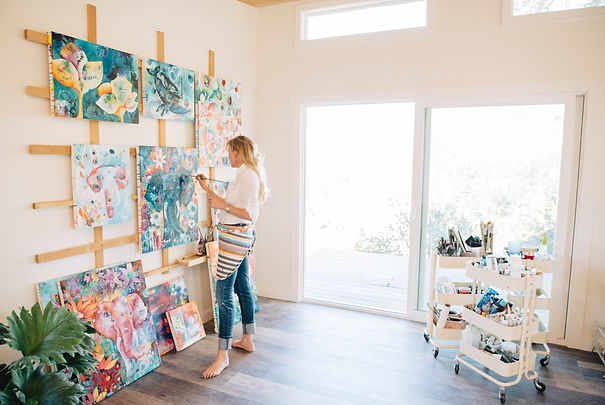
What are the coordinates of `painting` in the screenshot? It's located at (160, 185), (103, 169), (93, 84), (188, 89), (220, 107), (136, 321), (168, 300), (180, 314).